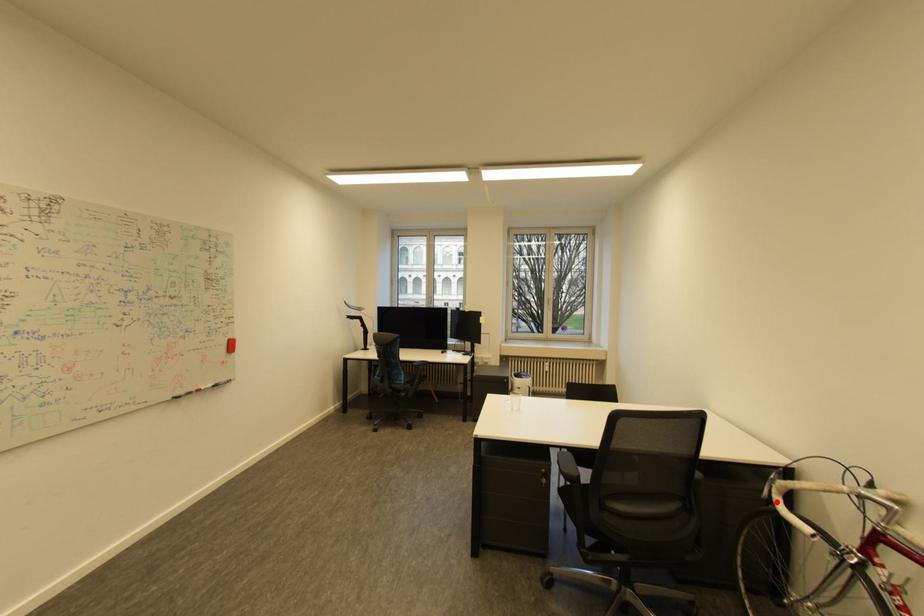
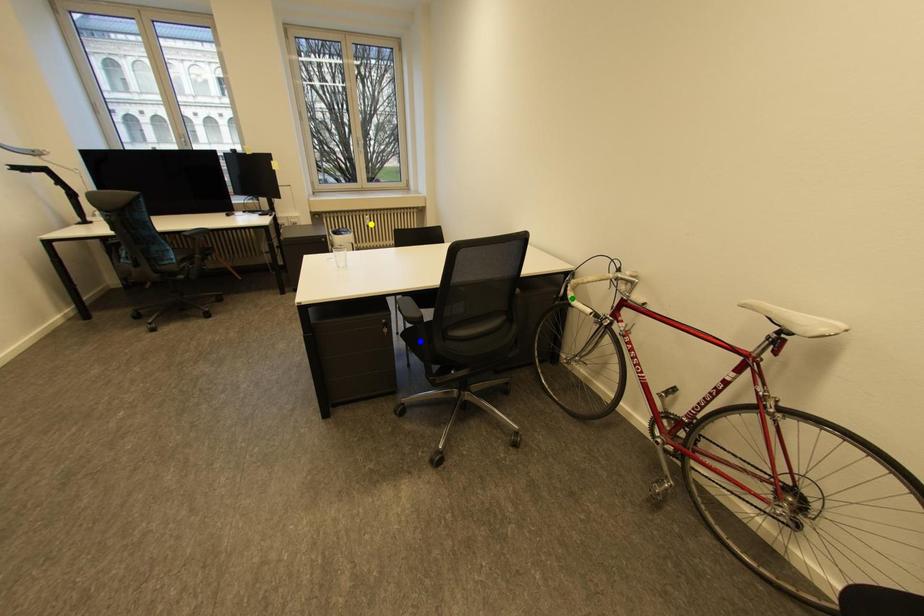
Question: I am providing you with two images of the same scene from different viewpoints. A red point is marked on the first image. You are given multiple points on the second image. In image 2, which mark is for the same physical point as the one in image 1?

Choices:
 (A) yellow point
 (B) blue point
 (C) green point

Answer: (C)